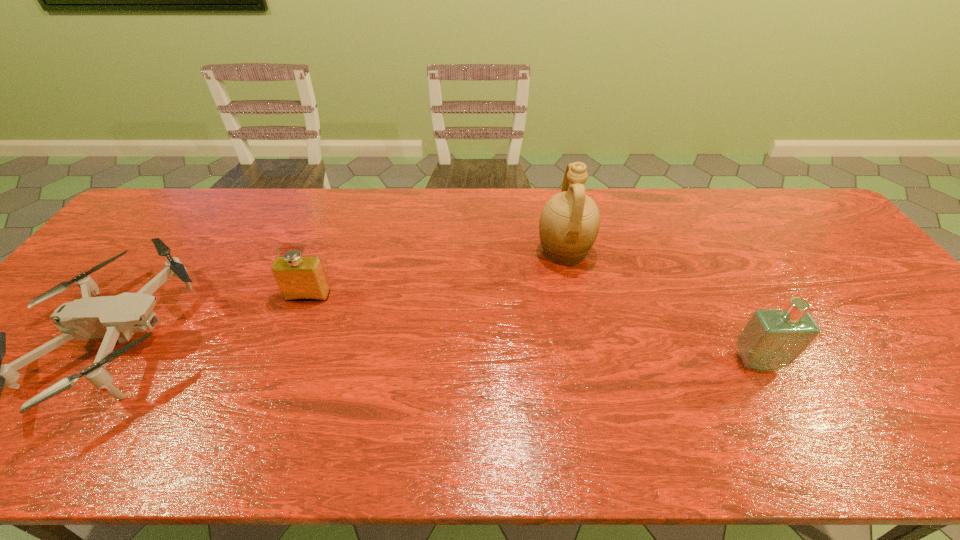
Image resolution: width=960 pixels, height=540 pixels. In order to click on pitcher in this screenshot , I will do `click(569, 223)`.

Image resolution: width=960 pixels, height=540 pixels. I want to click on the tallest object, so click(569, 223).

Identify the location of the rightmost object. (772, 339).

Where is `the right perfume`? This screenshot has height=540, width=960. the right perfume is located at coordinates (772, 339).

This screenshot has height=540, width=960. I want to click on the farther perfume, so click(x=299, y=278).

At what (x,y) coordinates should I click in order to perform the action: click on the left perfume. Please return your answer as a coordinate pair (x, y). The image size is (960, 540). Looking at the image, I should click on click(x=299, y=278).

Locate an element on the screen. This screenshot has height=540, width=960. free location located 0.220m on the right of the third object from left to right is located at coordinates (666, 252).

Where is `vacant space situated on the front label of the right perfume`? The width and height of the screenshot is (960, 540). vacant space situated on the front label of the right perfume is located at coordinates (780, 402).

Where is `free space located on the front-facing side of the left perfume`? free space located on the front-facing side of the left perfume is located at coordinates (259, 427).

This screenshot has width=960, height=540. What are the coordinates of `object that is at the far edge` in the screenshot? It's located at (569, 223).